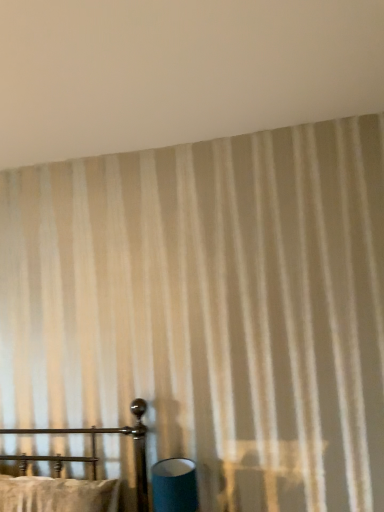
The height and width of the screenshot is (512, 384). Identify the location of metal bed frame at lower left. tap(95, 449).

Describe the element at coordinates (174, 486) in the screenshot. I see `matte blue cylinder at lower center` at that location.

Image resolution: width=384 pixels, height=512 pixels. Identify the location of beige striped curtain at upper center. tap(178, 71).

What is the approximate width of beige striped curtain at upper center?

The width of beige striped curtain at upper center is 1.09 meters.

You are a GUI agent. You are given a task and a screenshot of the screen. Output one action in this format:
    pyautogui.click(x=<x>, y=<y>)
    Task: Click on the metal bed frame at lower left
    
    Given the screenshot: What is the action you would take?
    pyautogui.click(x=95, y=449)

Can you confirm if metal bed frame at lower left is wider than beige striped curtain at upper center?

No, metal bed frame at lower left is not wider than beige striped curtain at upper center.

Where is `furniture below the beige striped curtain at upper center (from a real-world perspective)`? The height and width of the screenshot is (512, 384). furniture below the beige striped curtain at upper center (from a real-world perspective) is located at coordinates (95, 449).

In the scene shown: Is beige striped curtain at upper center inside metal bed frame at lower left?

Definitely not — beige striped curtain at upper center is not inside metal bed frame at lower left.

How far apart are metal bed frame at lower left and beige striped curtain at upper center?

They are 1.39 meters apart.

From a real-world perspective, who is located lower, matte blue cylinder at lower center or metal bed frame at lower left?

matte blue cylinder at lower center, from a real-world perspective.

Which is behind, point (174, 501) or point (136, 473)?

Positioned behind is point (136, 473).

Is matte blue cylinder at lower center directly adjacent to metal bed frame at lower left?

No, matte blue cylinder at lower center is not in contact with metal bed frame at lower left.

In terms of width, does beige striped curtain at upper center look wider or thinner when compared to matte blue cylinder at lower center?

Considering their sizes, beige striped curtain at upper center looks broader than matte blue cylinder at lower center.

Consider the image. Can you confirm if beige striped curtain at upper center is shorter than matte blue cylinder at lower center?

Indeed, beige striped curtain at upper center has a lesser height compared to matte blue cylinder at lower center.

Which is in front, point (186, 128) or point (184, 472)?

Point (184, 472)

From the image's perspective, is beige striped curtain at upper center located beneath metal bed frame at lower left?

Actually, beige striped curtain at upper center appears above metal bed frame at lower left in the image.

The image size is (384, 512). Find the location of `backdrop that appears above the metal bed frame at lower left (from a real-world perspective)`. backdrop that appears above the metal bed frame at lower left (from a real-world perspective) is located at coordinates (178, 71).

In the scene shown: Which of these two, beige striped curtain at upper center or metal bed frame at lower left, is bigger?

metal bed frame at lower left.

Is point (40, 69) positioned in front of point (19, 456)?

Yes.

Which is further, (169, 490) or (105, 27)?

Point (169, 490)

Which of these two, matte blue cylinder at lower center or beige striped curtain at upper center, stands shorter?

With less height is beige striped curtain at upper center.

Is matte blue cylinder at lower center not within beige striped curtain at upper center?

Yes, matte blue cylinder at lower center is outside of beige striped curtain at upper center.

Does matte blue cylinder at lower center have a smaller size compared to beige striped curtain at upper center?

Yes.

Does metal bed frame at lower left appear on the right side of matte blue cylinder at lower center?

Incorrect, metal bed frame at lower left is not on the right side of matte blue cylinder at lower center.

Is matte blue cylinder at lower center located within metal bed frame at lower left?

No.

Is metal bed frame at lower left thinner than matte blue cylinder at lower center?

In fact, metal bed frame at lower left might be wider than matte blue cylinder at lower center.

This screenshot has height=512, width=384. Identify the location of backdrop lying on the right of metal bed frame at lower left. (178, 71).

The image size is (384, 512). What are the coordinates of `furniture on the left of matte blue cylinder at lower center` in the screenshot? It's located at (95, 449).

Looking at the image, which one is located closer to metal bed frame at lower left, matte blue cylinder at lower center or beige striped curtain at upper center?

matte blue cylinder at lower center is closer to metal bed frame at lower left.

Based on their spatial positions, is matte blue cylinder at lower center or metal bed frame at lower left closer to beige striped curtain at upper center?

metal bed frame at lower left is positioned closer to the anchor beige striped curtain at upper center.

Estimate the real-world distances between objects in this image. Which object is further from beige striped curtain at upper center, metal bed frame at lower left or matte blue cylinder at lower center?

The object further to beige striped curtain at upper center is matte blue cylinder at lower center.

Based on their spatial positions, is metal bed frame at lower left or beige striped curtain at upper center closer to matte blue cylinder at lower center?

Based on the image, metal bed frame at lower left appears to be nearer to matte blue cylinder at lower center.

Considering their positions, is beige striped curtain at upper center positioned closer to matte blue cylinder at lower center than metal bed frame at lower left?

metal bed frame at lower left is closer to matte blue cylinder at lower center.

From the image, which object appears to be nearer to metal bed frame at lower left, beige striped curtain at upper center or matte blue cylinder at lower center?

matte blue cylinder at lower center.

The width and height of the screenshot is (384, 512). I want to click on furniture between beige striped curtain at upper center and matte blue cylinder at lower center vertically, so click(x=95, y=449).